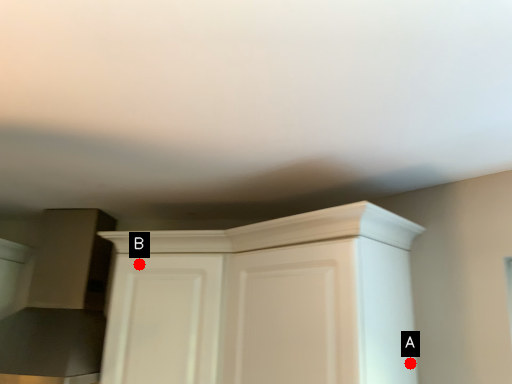
Question: Two points are circled on the image, labeled by A and B beside each circle. Which point is further to the camera?

Choices:
 (A) A is further
 (B) B is further

Answer: (B)